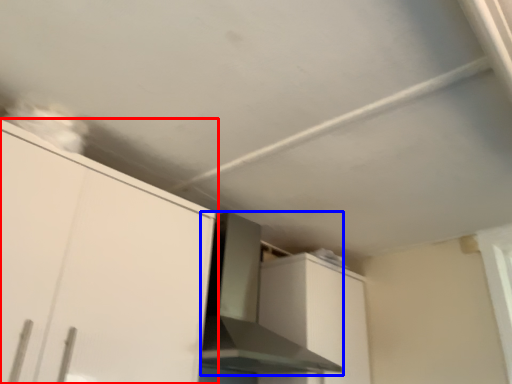
Question: Which point is further to the camera, cabinetry (highlighted by a red box) or vent (highlighted by a blue box)?

Choices:
 (A) cabinetry
 (B) vent

Answer: (B)